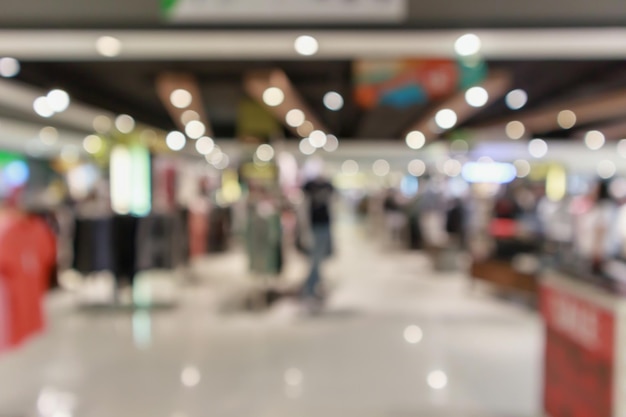
This screenshot has width=626, height=417. Identify the location of floor. (409, 359).